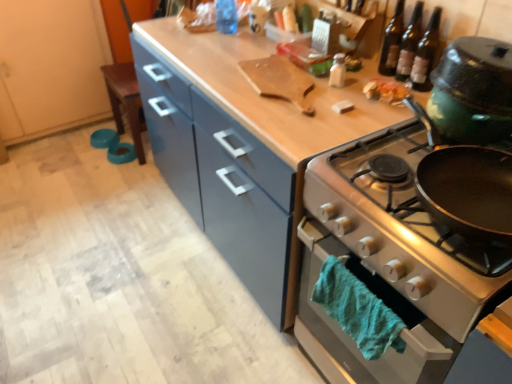
Locate an element on the screen. This screenshot has height=384, width=512. silver metallic oven at right is located at coordinates (392, 259).

The height and width of the screenshot is (384, 512). What do you see at coordinates (386, 91) in the screenshot?
I see `shiny plastic container at upper right` at bounding box center [386, 91].

You are a GUI agent. You are given a task and a screenshot of the screen. Output one action in this format:
    pyautogui.click(x=<x>, y=<y>)
    Task: Click on the dark brown glass bottles at upper right, which is counted as the 1th beer bottle, starting from the left
    
    Given the screenshot: What is the action you would take?
    pyautogui.click(x=392, y=42)

What do you see at coordinates (413, 196) in the screenshot?
I see `shiny silver gas stove at right` at bounding box center [413, 196].

Locate an element on the screen. silver metallic oven at right is located at coordinates (392, 259).

Which of these two, shiny plastic container at upper right or shiny silver gas stove at right, is wider?

Wider between the two is shiny silver gas stove at right.

In terms of height, does shiny plastic container at upper right look taller or shorter compared to shiny silver gas stove at right?

Clearly, shiny plastic container at upper right is shorter compared to shiny silver gas stove at right.

Consider the image. Between shiny plastic container at upper right and shiny silver gas stove at right, which one has smaller size?

Smaller between the two is shiny plastic container at upper right.

Which object is further away from the camera, shiny plastic container at upper right or shiny silver gas stove at right?

shiny plastic container at upper right.

Does translucent glass bottles at upper right, placed as the 2th beer bottle when sorted from left to right, turn towards shiny plastic container at upper right?

Yes, translucent glass bottles at upper right, placed as the 2th beer bottle when sorted from left to right, is aimed at shiny plastic container at upper right.

How many degrees apart are the facing directions of translucent glass bottles at upper right, placed as the 2th beer bottle when sorted from left to right, and shiny plastic container at upper right?

40.1 degrees.

Does point (431, 28) come closer to viewer compared to point (390, 92)?

No, (431, 28) is behind (390, 92).

From the picture: From the image's perspective, is translucent glass bottles at upper right, which is counted as the 1th beer bottle, starting from the right, positioned above or below shiny plastic container at upper right?

translucent glass bottles at upper right, which is counted as the 1th beer bottle, starting from the right, is situated higher than shiny plastic container at upper right in the image.

How different are the orientations of wooden cutting board at upper center and transparent plastic bottle at upper center, the 2th bottle when ordered from right to left, in degrees?

wooden cutting board at upper center and transparent plastic bottle at upper center, the 2th bottle when ordered from right to left, are facing 3.61 degrees away from each other.

Is there a large distance between wooden cutting board at upper center and transparent plastic bottle at upper center, the first bottle viewed from the top?

No, wooden cutting board at upper center is not far from transparent plastic bottle at upper center, the first bottle viewed from the top.

Consider the image. From a real-world perspective, between wooden cutting board at upper center and transparent plastic bottle at upper center, the 2th bottle when ordered from right to left, who is vertically lower?

wooden cutting board at upper center is physically lower.

From the image's perspective, which is below, wooden cutting board at upper center or transparent plastic bottle at upper center, which appears as the 2th bottle when ordered from the bottom?

wooden cutting board at upper center.

From a real-world perspective, between silver metallic oven at right and white matte salt shaker at center, positioned as the 1th bottle in bottom-to-top order, who is vertically higher?

From a 3D spatial view, white matte salt shaker at center, positioned as the 1th bottle in bottom-to-top order, is above.

Would you say silver metallic oven at right is outside white matte salt shaker at center, which ranks as the second bottle in left-to-right order?

silver metallic oven at right is positioned outside white matte salt shaker at center, which ranks as the second bottle in left-to-right order.

Considering the sizes of objects silver metallic oven at right and white matte salt shaker at center, which ranks as the second bottle in left-to-right order, in the image provided, who is bigger, silver metallic oven at right or white matte salt shaker at center, which ranks as the second bottle in left-to-right order,?

silver metallic oven at right is bigger.

Considering the relative sizes of teal fuzzy towel at lower right and shiny plastic container at upper right in the image provided, is teal fuzzy towel at lower right shorter than shiny plastic container at upper right?

No.

Which is behind, point (359, 288) or point (391, 100)?

The point (391, 100) is behind.

From the image's perspective, is teal fuzzy towel at lower right on top of shiny plastic container at upper right?

No, from the image's perspective, teal fuzzy towel at lower right is not above shiny plastic container at upper right.

Can you confirm if teal fuzzy towel at lower right is smaller than shiny plastic container at upper right?

No.

From the picture: Between clear glass bottles at upper right and translucent glass bottles at upper right, which is counted as the 1th beer bottle, starting from the right, which one has smaller width?

translucent glass bottles at upper right, which is counted as the 1th beer bottle, starting from the right, is thinner.

In the image, is clear glass bottles at upper right positioned in front of or behind translucent glass bottles at upper right, placed as the 2th beer bottle when sorted from left to right?

clear glass bottles at upper right is positioned farther from the viewer than translucent glass bottles at upper right, placed as the 2th beer bottle when sorted from left to right.

Between point (400, 47) and point (429, 42), which one is positioned behind?

Positioned behind is point (400, 47).

How many degrees apart are the facing directions of clear glass bottles at upper right and translucent glass bottles at upper right, placed as the 2th beer bottle when sorted from left to right?

The angle between the facing direction of clear glass bottles at upper right and the facing direction of translucent glass bottles at upper right, placed as the 2th beer bottle when sorted from left to right, is 4.33 degrees.

In terms of width, does dark brown glass bottles at upper right, which is counted as the 1th beer bottle, starting from the left, look wider or thinner when compared to silver metallic oven at right?

dark brown glass bottles at upper right, which is counted as the 1th beer bottle, starting from the left, is thinner than silver metallic oven at right.

Does point (388, 37) come closer to viewer compared to point (478, 297)?

No.

Can you tell me how much dark brown glass bottles at upper right, the 2th beer bottle when ordered from right to left, and silver metallic oven at right differ in facing direction?

dark brown glass bottles at upper right, the 2th beer bottle when ordered from right to left, and silver metallic oven at right are facing 0.256 degrees away from each other.

From the image's perspective, does dark brown glass bottles at upper right, the 2th beer bottle when ordered from right to left, appear lower than silver metallic oven at right?

Incorrect, from the image's perspective, dark brown glass bottles at upper right, the 2th beer bottle when ordered from right to left, is higher than silver metallic oven at right.

You are a GUI agent. You are given a task and a screenshot of the screen. Output one action in this format:
    pyautogui.click(x=<x>, y=<y>)
    Task: Click on the gas stove that is above the shiny plastic container at upper right (from a real-world perspective)
    This screenshot has height=384, width=512.
    Given the screenshot: What is the action you would take?
    pyautogui.click(x=413, y=196)

You are a GUI agent. You are given a task and a screenshot of the screen. Output one action in this format:
    pyautogui.click(x=<x>, y=<y>)
    Task: Click on the food below the translucent glass bottles at upper right, placed as the 2th beer bottle when sorted from left to right (from a real-world perspective)
    The height and width of the screenshot is (384, 512).
    Given the screenshot: What is the action you would take?
    pyautogui.click(x=386, y=91)

Which object lies nearer to the anchor point teal fuzzy towel at lower right, white matte salt shaker at center, which ranks as the second bottle in left-to-right order, or wooden cutting board at upper center?

Among the two, wooden cutting board at upper center is located nearer to teal fuzzy towel at lower right.

From the image, which object appears to be farther from transparent plastic bottle at upper center, acting as the 1th bottle starting from the back, silver metallic oven at right or shiny plastic container at upper right?

silver metallic oven at right is positioned further to the anchor transparent plastic bottle at upper center, acting as the 1th bottle starting from the back.

Which object lies further to the anchor point transparent plastic bottle at upper center, which appears as the 2th bottle when ordered from the bottom, teal fuzzy towel at lower right or dark brown glass bottles at upper right, the 2th beer bottle when ordered from right to left?

The object further to transparent plastic bottle at upper center, which appears as the 2th bottle when ordered from the bottom, is teal fuzzy towel at lower right.

Based on their spatial positions, is dark brown glass bottles at upper right, which is counted as the 1th beer bottle, starting from the left, or transparent plastic bottle at upper center, which appears as the 2th bottle when ordered from the bottom, closer to white matte salt shaker at center, acting as the 1th bottle starting from the front?

dark brown glass bottles at upper right, which is counted as the 1th beer bottle, starting from the left, is closer to white matte salt shaker at center, acting as the 1th bottle starting from the front.

Based on their spatial positions, is shiny plastic container at upper right or dark brown glass bottles at upper right, which is counted as the 1th beer bottle, starting from the left, further from translucent glass bottles at upper right, placed as the 2th beer bottle when sorted from left to right?

Based on the image, shiny plastic container at upper right appears to be further to translucent glass bottles at upper right, placed as the 2th beer bottle when sorted from left to right.

Which object lies nearer to the anchor point translucent glass bottles at upper right, which is counted as the 1th beer bottle, starting from the right, white matte salt shaker at center, acting as the 1th bottle starting from the front, or silver metallic oven at right?

The object closer to translucent glass bottles at upper right, which is counted as the 1th beer bottle, starting from the right, is white matte salt shaker at center, acting as the 1th bottle starting from the front.

Which object lies further to the anchor point transparent plastic bottle at upper center, acting as the first bottle starting from the left, translucent glass bottles at upper right, which is counted as the 1th beer bottle, starting from the right, or shiny silver gas stove at right?

Among the two, shiny silver gas stove at right is located further to transparent plastic bottle at upper center, acting as the first bottle starting from the left.

When comparing their distances from white matte salt shaker at center, which is counted as the 2th bottle, starting from the back, does translucent glass bottles at upper right, placed as the 2th beer bottle when sorted from left to right, or teal fuzzy towel at lower right seem further?

Among the two, teal fuzzy towel at lower right is located further to white matte salt shaker at center, which is counted as the 2th bottle, starting from the back.

The width and height of the screenshot is (512, 384). Identify the location of oven positioned between shiny silver gas stove at right and white matte salt shaker at center, arranged as the 2th bottle when viewed from the top, from near to far. [392, 259].

Where is `oven positioned between shiny silver gas stove at right and clear glass bottles at upper right from near to far`? This screenshot has width=512, height=384. oven positioned between shiny silver gas stove at right and clear glass bottles at upper right from near to far is located at coordinates (392, 259).

Find the location of a particular element. This screenshot has width=512, height=384. countertop between transparent plastic bottle at upper center, the 2th bottle when ordered from right to left, and silver metallic oven at right from top to bottom is located at coordinates (318, 202).

Image resolution: width=512 pixels, height=384 pixels. Find the location of `food between wooden cutting board at upper center and clear glass bottles at upper right in the horizontal direction`. food between wooden cutting board at upper center and clear glass bottles at upper right in the horizontal direction is located at coordinates (386, 91).